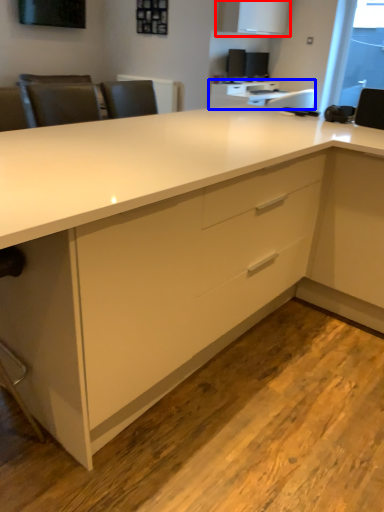
Question: Which object is further to the camera taking this photo, cabinetry (highlighted by a red box) or table (highlighted by a blue box)?

Choices:
 (A) cabinetry
 (B) table

Answer: (B)